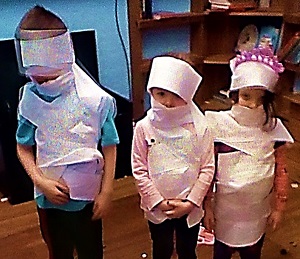
Image resolution: width=300 pixels, height=259 pixels. Identify the location of wall. (83, 18), (179, 8), (168, 41), (147, 103).